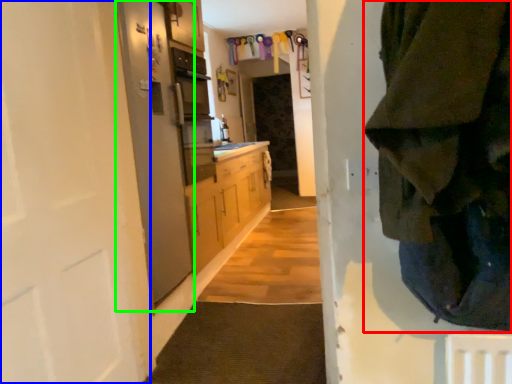
Question: Considering the real-world distances, which object is farthest from clothing (highlighted by a red box)? door (highlighted by a blue box) or screen door (highlighted by a green box)?

Choices:
 (A) door
 (B) screen door

Answer: (B)